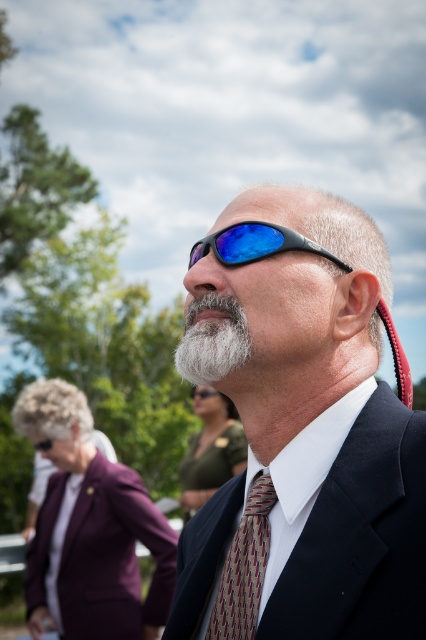
Question: Which point appears closest to the camera in this image?

Choices:
 (A) (417, 614)
 (B) (218, 305)
 (C) (262, 518)
 (D) (279, 252)

Answer: (A)

Question: Which of the following is the closest to the observer?

Choices:
 (A) white fuzzy beard at center
 (B) multicolored woven tie at center

Answer: (B)

Question: Does white fuzzy beard at center have a larger size compared to blue reflective plastic goggles at center?

Choices:
 (A) yes
 (B) no

Answer: (A)

Question: Which object is positioned farthest from the multicolored woven tie at center?

Choices:
 (A) matte black suit at center
 (B) white fuzzy beard at center
 (C) blue reflective plastic goggles at center

Answer: (C)

Question: Does white fuzzy beard at center have a lesser width compared to blue reflective plastic goggles at center?

Choices:
 (A) no
 (B) yes

Answer: (B)

Question: Does matte black suit at center have a larger size compared to white fuzzy beard at center?

Choices:
 (A) yes
 (B) no

Answer: (A)